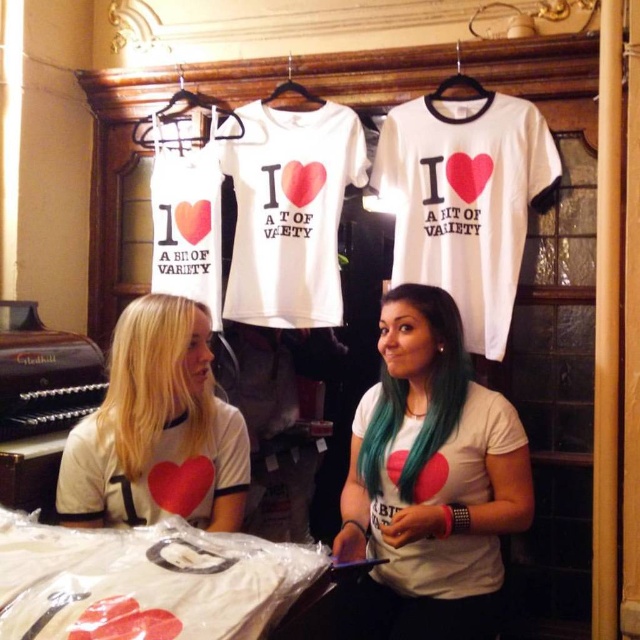
Question: Is white matte t-shirt at upper center behind blonde hair at left?

Choices:
 (A) no
 (B) yes

Answer: (B)

Question: Which point is closer to the camera?

Choices:
 (A) (128, 496)
 (B) (468, 106)
 (C) (144, 385)
 (D) (368, 433)

Answer: (C)

Question: Can you confirm if white matte t-shirt at center is positioned above teal glossy hair at center?

Choices:
 (A) no
 (B) yes

Answer: (A)

Question: Which of these objects is positioned closest to the white matte t-shirt at upper center?

Choices:
 (A) white matte t-shirt at center
 (B) matte white t-shirt at center
 (C) teal glossy hair at center

Answer: (C)

Question: Based on their relative distances, which object is nearer to the white matte t-shirt at upper center?

Choices:
 (A) blonde hair at left
 (B) matte white t-shirt at center

Answer: (A)

Question: Can you confirm if white cotton t-shirt at center is positioned to the right of teal glossy hair at center?

Choices:
 (A) no
 (B) yes

Answer: (A)